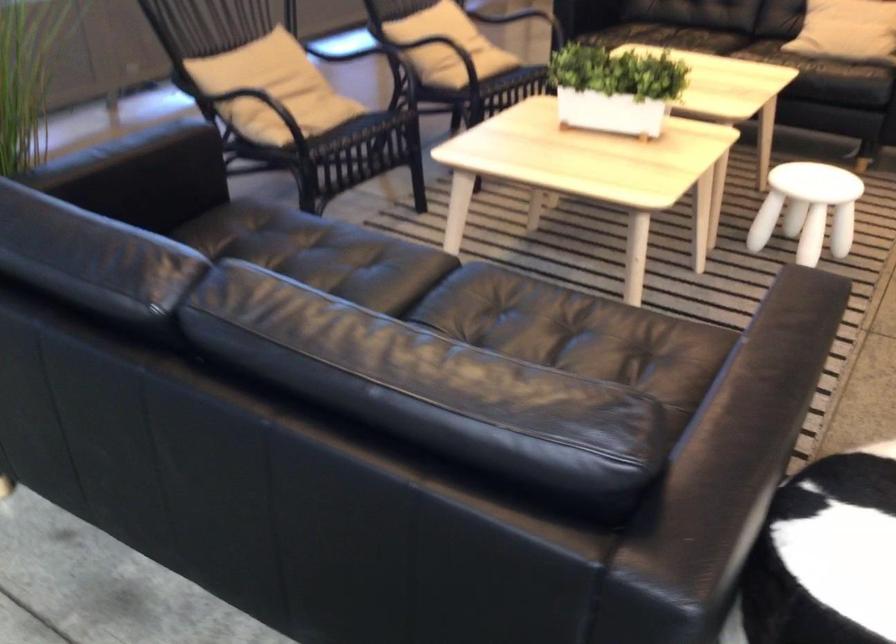
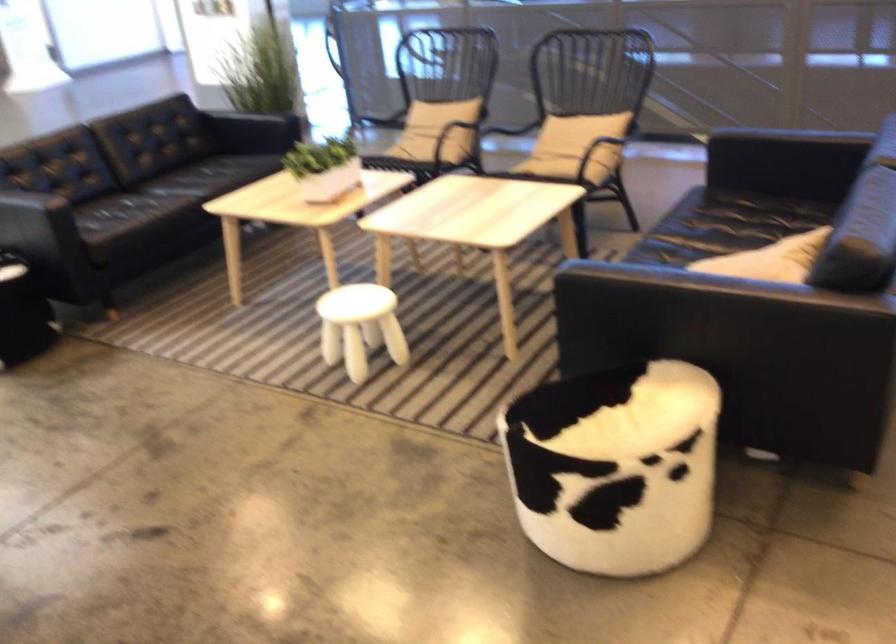
The point at (636,80) is marked in the first image. Where is the corresponding point in the second image?

(323, 167)